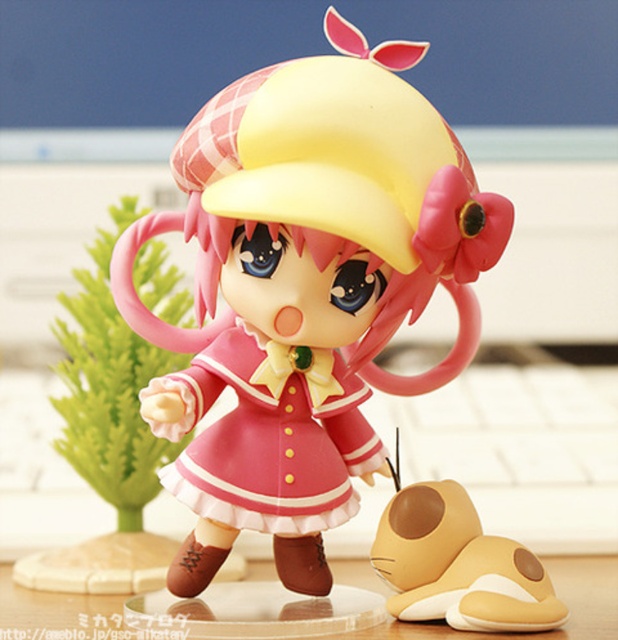
Question: Which point is farther to the camera?

Choices:
 (A) (261, 291)
 (B) (116, 628)
 (C) (265, 522)

Answer: (B)

Question: Can you confirm if matte pink plastic doll at center is positioned to the left of transparent acrylic table at center?

Choices:
 (A) yes
 (B) no

Answer: (A)

Question: Does pink matte dress at center have a lesser width compared to brown matte plush slippers at lower right?

Choices:
 (A) yes
 (B) no

Answer: (B)

Question: Considering the real-world distances, which object is farthest from the brown matte plush slippers at lower right?

Choices:
 (A) matte pink plastic doll at center
 (B) pink matte dress at center

Answer: (A)

Question: Where is brown matte plush slippers at lower right located in relation to transparent acrylic table at center in the image?

Choices:
 (A) below
 (B) above

Answer: (B)

Question: Which object is positioned farthest from the transparent acrylic table at center?

Choices:
 (A) brown matte plush slippers at lower right
 (B) matte pink plastic doll at center
 (C) pink matte dress at center

Answer: (B)